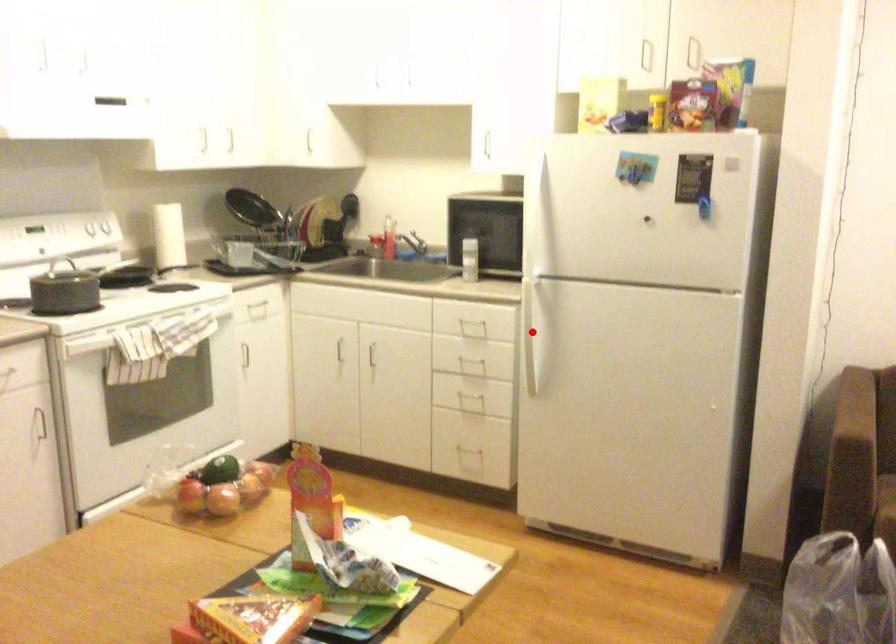
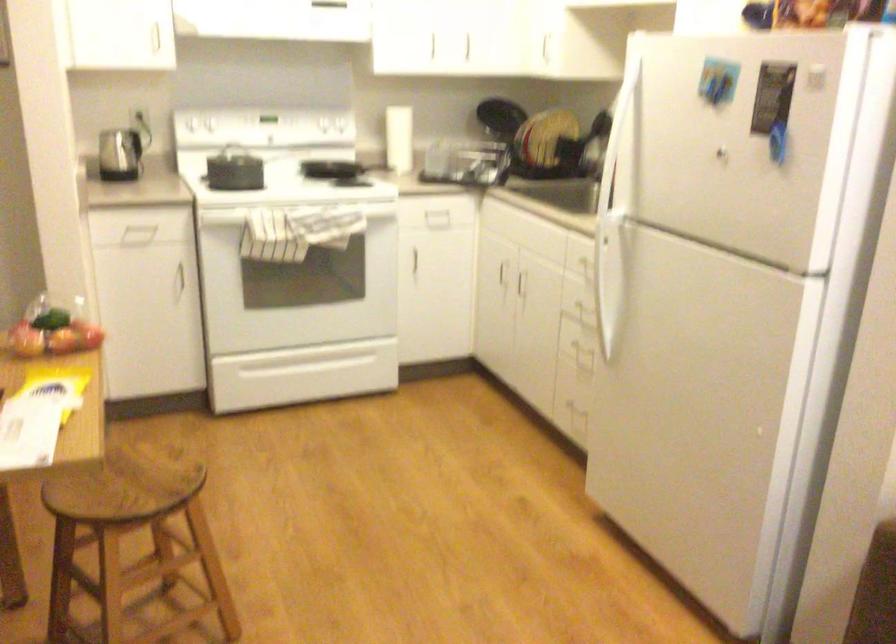
Question: I am providing you with two images of the same scene from different viewpoints. Image1 has a red point marked. In image2, the corresponding 3D location appears at what relative position? Reply with the corresponding letter.

Choices:
 (A) Closer
 (B) Farther

Answer: (A)